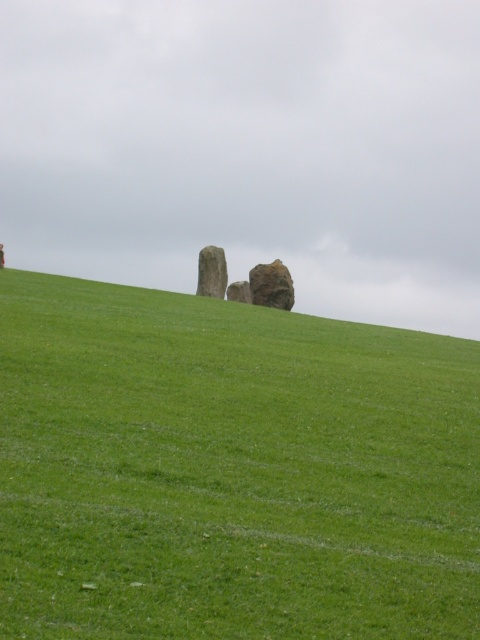
Question: Considering the real-world distances, which object is closest to the rough textured rock at center?

Choices:
 (A) smooth gray stone at center
 (B) green grassy hill at center

Answer: (A)

Question: Does rough textured rock at center appear on the left side of smooth stone statue at center?

Choices:
 (A) yes
 (B) no

Answer: (B)

Question: Does green grassy hill at center appear on the left side of smooth gray rock at center?

Choices:
 (A) no
 (B) yes

Answer: (A)

Question: Which object appears closest to the camera in this image?

Choices:
 (A) green grassy hill at center
 (B) smooth gray rock at center
 (C) rough textured rock at center
 (D) smooth gray stone at center

Answer: (A)

Question: Can you confirm if green grassy hill at center is positioned above smooth stone statue at center?

Choices:
 (A) no
 (B) yes

Answer: (A)

Question: Considering the real-world distances, which object is farthest from the green grassy hill at center?

Choices:
 (A) rough textured rock at center
 (B) smooth gray stone at center
 (C) smooth gray rock at center
 (D) smooth stone statue at center

Answer: (C)